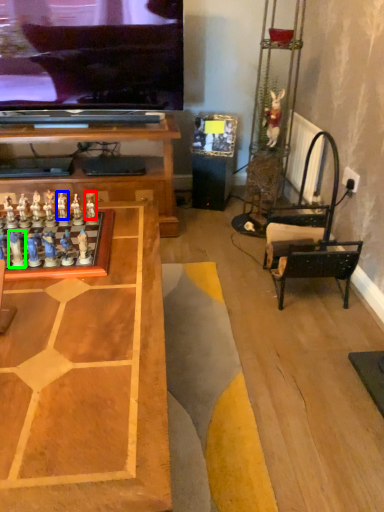
Question: Estimate the real-world distances between objects in this image. Which object is farther from toy (highlighted by a red box), toy (highlighted by a blue box) or toy (highlighted by a green box)?

Choices:
 (A) toy
 (B) toy

Answer: (B)